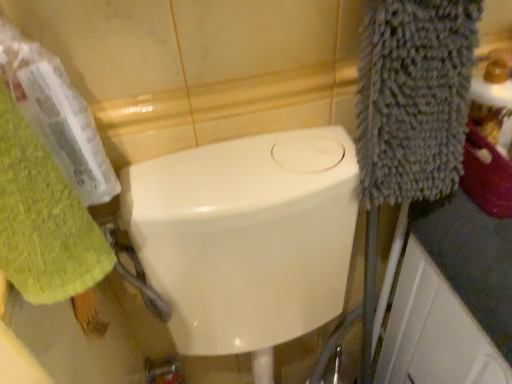
You are a GUI agent. You are given a task and a screenshot of the screen. Output one action in this format:
    pyautogui.click(x=<x>, y=<y>)
    Task: Click on the green textured towel at left
    The image size is (512, 384).
    Given the screenshot: What is the action you would take?
    pyautogui.click(x=42, y=219)

The image size is (512, 384). Describe the element at coordinates (42, 219) in the screenshot. I see `green textured towel at left` at that location.

Measure the distance between point (4, 175) and camera.

They are 11.42 inches apart.

Identify the location of white glossy bidet at center. (246, 236).

The width and height of the screenshot is (512, 384). Describe the element at coordinates (246, 236) in the screenshot. I see `white glossy bidet at center` at that location.

Identify the location of green textured towel at left. The image size is (512, 384). (42, 219).

Considering the relative positions of white glossy bidet at center and green textured towel at left in the image provided, is white glossy bidet at center to the left or to the right of green textured towel at left?

white glossy bidet at center is to the right of green textured towel at left.

Based on the photo, is white glossy bidet at center positioned before green textured towel at left?

That is False.

Does point (186, 221) come farther from viewer compared to point (92, 257)?

That is True.

From the image's perspective, would you say white glossy bidet at center is shown under green textured towel at left?

Yes.

From a real-world perspective, is white glossy bidet at center over green textured towel at left?

No, from a real-world perspective, white glossy bidet at center is not over green textured towel at left

Looking at this image, does white glossy bidet at center have a lesser width compared to green textured towel at left?

Incorrect, the width of white glossy bidet at center is not less than that of green textured towel at left.

Considering the relative sizes of white glossy bidet at center and green textured towel at left in the image provided, is white glossy bidet at center shorter than green textured towel at left?

Incorrect, the height of white glossy bidet at center does not fall short of that of green textured towel at left.

Is white glossy bidet at center smaller than green textured towel at left?

Actually, white glossy bidet at center might be larger than green textured towel at left.

Would you say white glossy bidet at center is outside green textured towel at left?

That's correct, white glossy bidet at center is outside of green textured towel at left.

Is white glossy bidet at center far away from green textured towel at left?

No, white glossy bidet at center is not far away from green textured towel at left.

Could you tell me if white glossy bidet at center is facing green textured towel at left?

No, white glossy bidet at center is not oriented towards green textured towel at left.

How many degrees apart are the facing directions of white glossy bidet at center and green textured towel at left?

There is a 88.6-degree angle between the facing directions of white glossy bidet at center and green textured towel at left.

Measure the distance from white glossy bidet at center to green textured towel at left.

white glossy bidet at center and green textured towel at left are 10.56 inches apart from each other.

Locate an element on the screen. towel/napkin above the white glossy bidet at center (from the image's perspective) is located at coordinates (42, 219).

Is green textured towel at left at the right side of white glossy bidet at center?

Incorrect, green textured towel at left is not on the right side of white glossy bidet at center.

Is green textured towel at left behind white glossy bidet at center?

No, it is in front of white glossy bidet at center.

Is point (99, 269) closer or farther from the camera than point (234, 265)?

Clearly, point (99, 269) is closer to the camera than point (234, 265).

From the image's perspective, would you say green textured towel at left is positioned over white glossy bidet at center?

Correct, green textured towel at left appears higher than white glossy bidet at center in the image.

From a real-world perspective, relative to white glossy bidet at center, is green textured towel at left vertically above or below?

Clearly, from a real-world perspective, green textured towel at left is above white glossy bidet at center.

Which object is thinner, green textured towel at left or white glossy bidet at center?

green textured towel at left.

Is green textured towel at left taller or shorter than white glossy bidet at center?

green textured towel at left is shorter than white glossy bidet at center.

Is green textured towel at left bigger than white glossy bidet at center?

No.

Is green textured towel at left located outside white glossy bidet at center?

green textured towel at left lies outside white glossy bidet at center's area.

Would you consider green textured towel at left to be distant from white glossy bidet at center?

green textured towel at left is near white glossy bidet at center, not far away.

Could you tell me if green textured towel at left is facing white glossy bidet at center?

No, green textured towel at left is not turned towards white glossy bidet at center.

The width and height of the screenshot is (512, 384). Find the location of `towel/napkin on the left of the white glossy bidet at center`. towel/napkin on the left of the white glossy bidet at center is located at coordinates (42, 219).

Image resolution: width=512 pixels, height=384 pixels. In order to click on towel/napkin lying in front of the white glossy bidet at center in this screenshot , I will do `click(42, 219)`.

Identify the location of bidet that appears behind the green textured towel at left. Image resolution: width=512 pixels, height=384 pixels. (246, 236).